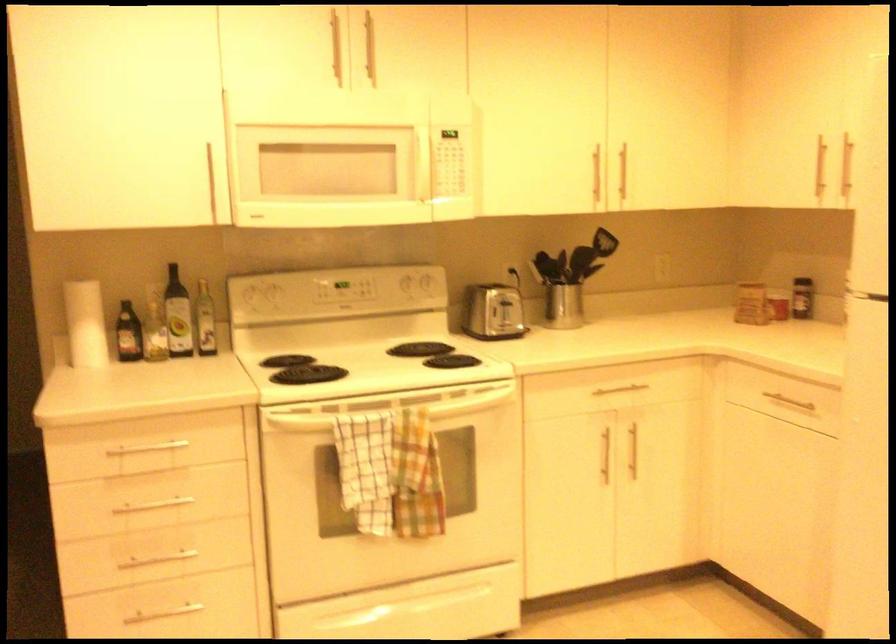
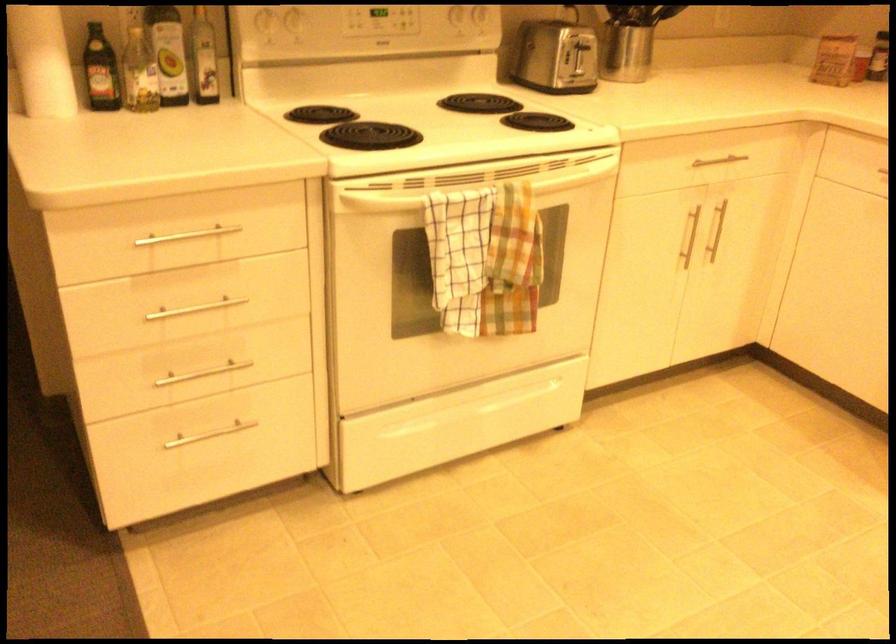
Locate, in the second image, the point that corresponds to point 287,424 in the first image.

(374, 202)